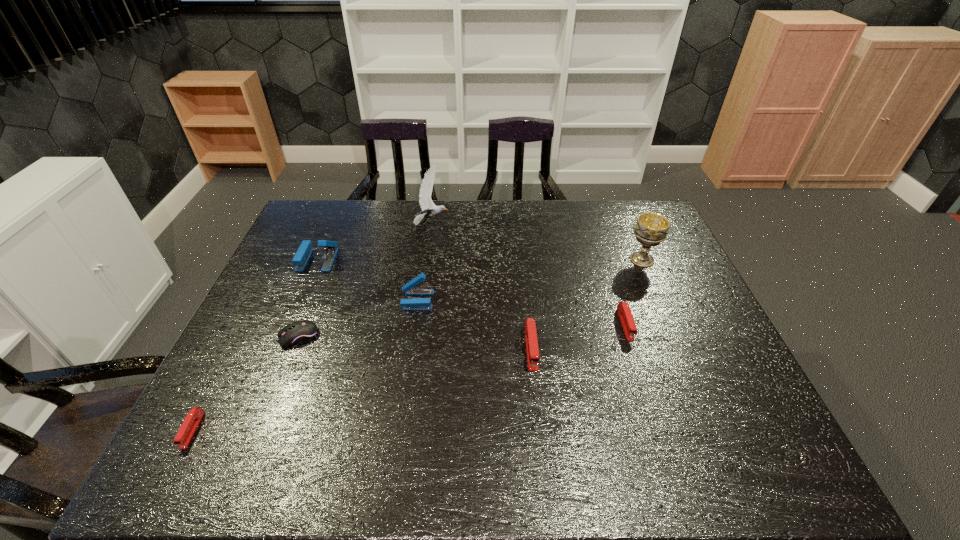
Find the location of `vacant region at the far left corner of the desktop`. vacant region at the far left corner of the desktop is located at coordinates (334, 200).

The image size is (960, 540). In the image, there is a desktop. Find the location of `vacant space at the near left corner`. vacant space at the near left corner is located at coordinates (253, 444).

You are a GUI agent. You are given a task and a screenshot of the screen. Output one action in this format:
    pyautogui.click(x=<x>, y=<y>)
    Task: Click on the vacant space at the near right corner
    
    Given the screenshot: What is the action you would take?
    pyautogui.click(x=756, y=477)

This screenshot has width=960, height=540. What are the coordinates of `unoccupied area between the rightmost red stapler and the nearest red stapler` in the screenshot? It's located at (409, 377).

Locate an element on the screen. vacant point located between the rightmost stapler and the sixth object from left to right is located at coordinates (578, 336).

Locate an element on the screen. free spot between the second smallest red stapler and the farther blue stapler is located at coordinates (471, 292).

Locate an element on the screen. The height and width of the screenshot is (540, 960). vacant point located between the second smallest red stapler and the farther blue stapler is located at coordinates (471, 292).

The height and width of the screenshot is (540, 960). In order to click on free area in between the fourth tallest stapler and the fourth shortest object in this screenshot , I will do `click(578, 336)`.

Where is `blank region between the rightmost object and the computer mouse`? This screenshot has width=960, height=540. blank region between the rightmost object and the computer mouse is located at coordinates (470, 298).

Identify the location of free space between the white gull and the fourth stapler from left to right. (481, 286).